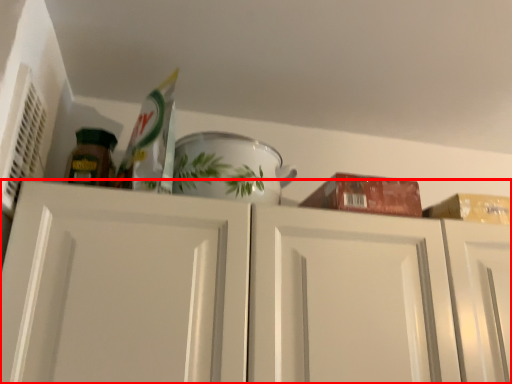
Question: From the image's perspective, what is the correct spatial positioning of cabinetry (annotated by the red box) in reference to tableware?

Choices:
 (A) below
 (B) above

Answer: (A)